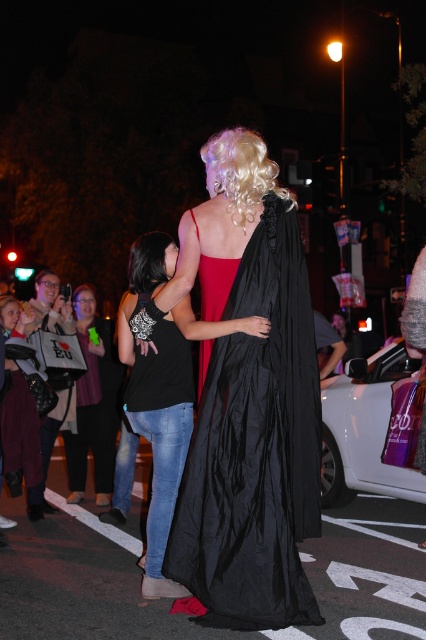
Based on the photo, you are a photographer trying to capture the blonde curly wig at upper center. The camera you are using has a limited field of view, so you can only focus on objects within a specific area. Based on the coordinates provided, can you confirm if the point at (241, 172) is within the frame of the image?

The point at (241, 172) marks the blonde curly wig at upper center, so yes, it is within the frame of the image.

You are a photographer trying to capture a clear shot of the black silky hair at center and the maroon fabric coat at lower left. Which object should you focus on first to ensure it appears sharp in the photo?

You should focus on the maroon fabric coat at lower left first because it is closer to you than the black silky hair at center, ensuring it stays sharp in the photo.